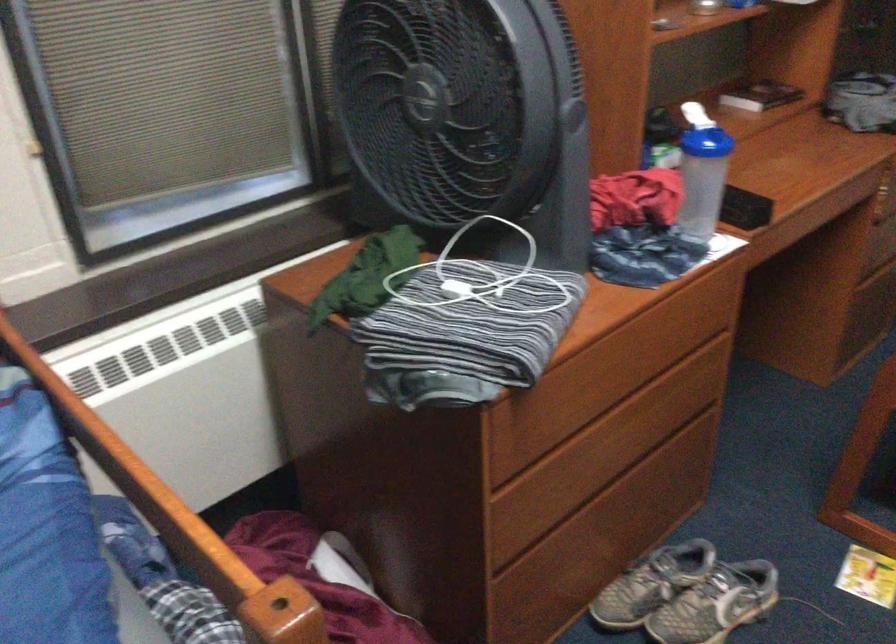
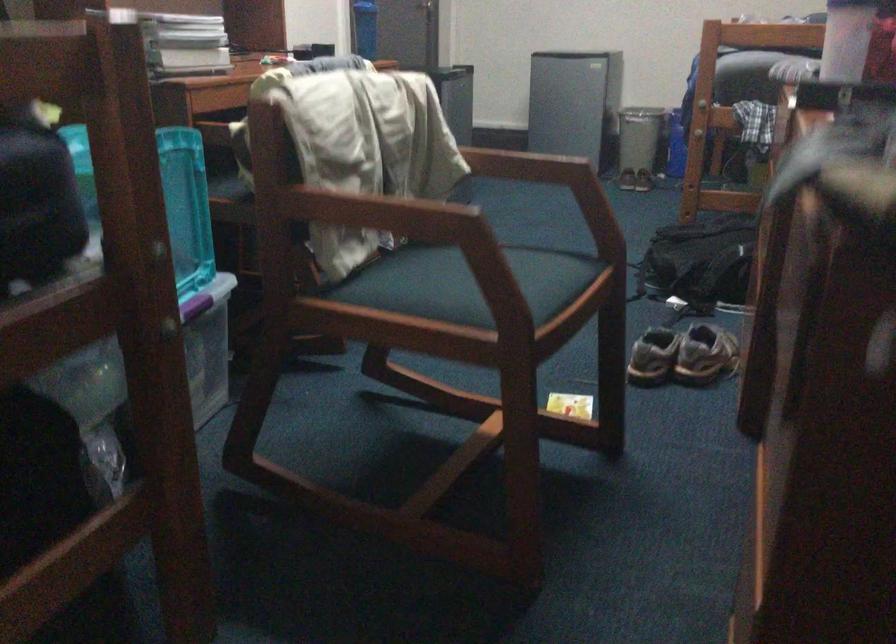
Locate, in the second image, the point that corresponds to point 725,558 in the first image.

(682, 355)